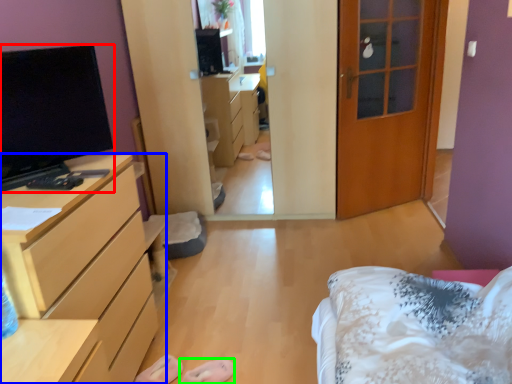
Question: Considering the real-world distances, which object is closest to television (highlighted by a red box)? chest of drawers (highlighted by a blue box) or shoe (highlighted by a green box).

Choices:
 (A) chest of drawers
 (B) shoe

Answer: (A)